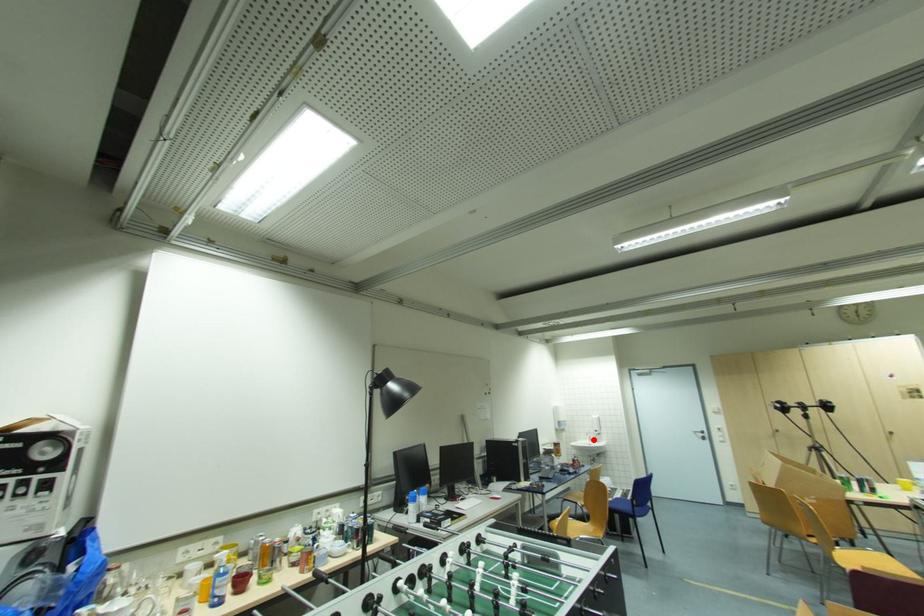
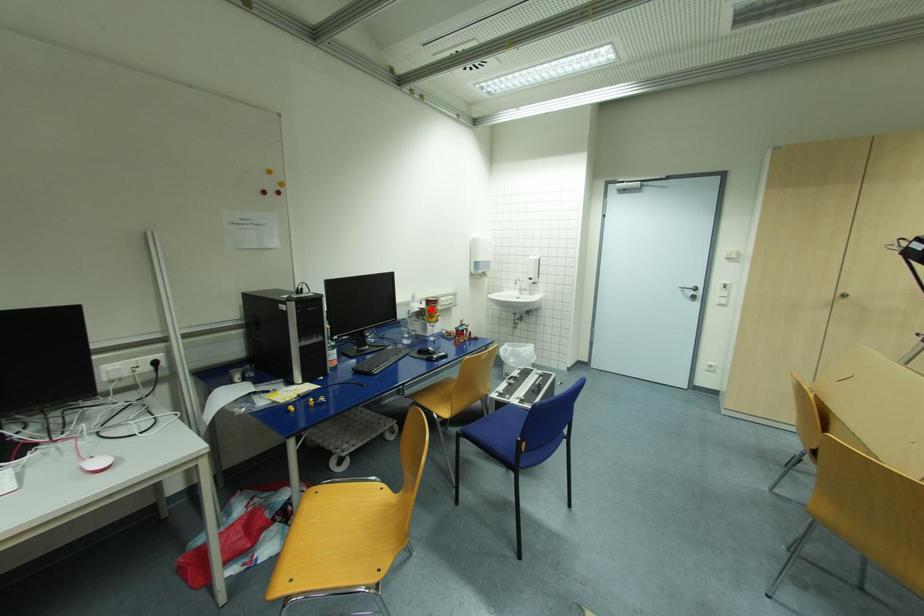
I am providing you with two images of the same scene from different viewpoints. A red point is marked on the first image and another point is marked on the second image. Is the marked point in image1 the same physical position as the marked point in image2?

No